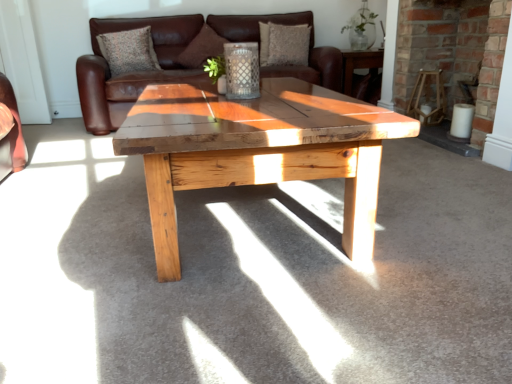
Question: From a real-world perspective, is brick fireplace at center positioned over brown suede pillow at center, which is the second pillow in right-to-left order, based on gravity?

Choices:
 (A) yes
 (B) no

Answer: (B)

Question: Is brown suede pillow at center, positioned as the second pillow in left-to-right order, located within brick fireplace at center?

Choices:
 (A) no
 (B) yes

Answer: (A)

Question: Is brick fireplace at center behind brown suede pillow at center, positioned as the second pillow in left-to-right order?

Choices:
 (A) no
 (B) yes

Answer: (A)

Question: Can you confirm if brick fireplace at center is shorter than brown suede pillow at center, positioned as the second pillow in left-to-right order?

Choices:
 (A) no
 (B) yes

Answer: (A)

Question: Can you confirm if brick fireplace at center is wider than brown suede pillow at center, positioned as the second pillow in left-to-right order?

Choices:
 (A) no
 (B) yes

Answer: (A)

Question: From the image's perspective, would you say brick fireplace at center is shown under brown suede pillow at center, positioned as the second pillow in left-to-right order?

Choices:
 (A) no
 (B) yes

Answer: (B)

Question: Is brown suede pillow at center, positioned as the second pillow in left-to-right order, to the left of textured fabric pillow at upper center, the 1th pillow when ordered from left to right, from the viewer's perspective?

Choices:
 (A) no
 (B) yes

Answer: (A)

Question: Is brown suede pillow at center, positioned as the second pillow in left-to-right order, further to the viewer compared to textured fabric pillow at upper center, which appears as the 3th pillow when viewed from the right?

Choices:
 (A) yes
 (B) no

Answer: (A)

Question: Is brown suede pillow at center, positioned as the second pillow in left-to-right order, closer to camera compared to textured fabric pillow at upper center, the 1th pillow when ordered from left to right?

Choices:
 (A) yes
 (B) no

Answer: (B)

Question: Considering the relative sizes of brown suede pillow at center, which is the second pillow in right-to-left order, and textured fabric pillow at upper center, the 1th pillow when ordered from left to right, in the image provided, is brown suede pillow at center, which is the second pillow in right-to-left order, smaller than textured fabric pillow at upper center, the 1th pillow when ordered from left to right,?

Choices:
 (A) no
 (B) yes

Answer: (A)

Question: Is brown suede pillow at center, positioned as the second pillow in left-to-right order, looking in the opposite direction of textured fabric pillow at upper center, which appears as the 3th pillow when viewed from the right?

Choices:
 (A) yes
 (B) no

Answer: (B)

Question: From the image's perspective, is brown suede pillow at center, positioned as the second pillow in left-to-right order, located beneath textured fabric pillow at upper center, the 1th pillow when ordered from left to right?

Choices:
 (A) no
 (B) yes

Answer: (A)

Question: Can you confirm if brown suede pillow at center, which is the second pillow in right-to-left order, is wider than brown leather couch at center?

Choices:
 (A) no
 (B) yes

Answer: (A)